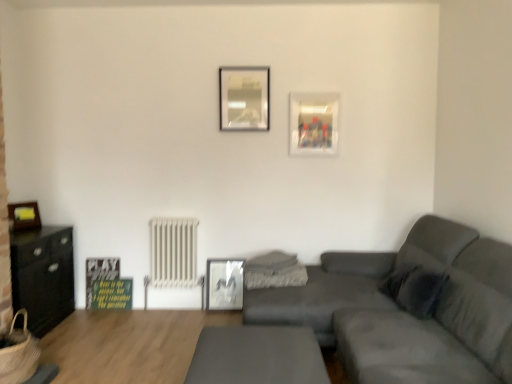
Question: Can you confirm if white metallic radiator at center-left is taller than matte black picture frame at left, which is the second picture frame from bottom to top?

Choices:
 (A) no
 (B) yes

Answer: (B)

Question: From the image's perspective, is white metallic radiator at center-left over matte black picture frame at left, which is the second picture frame from bottom to top?

Choices:
 (A) no
 (B) yes

Answer: (A)

Question: Is white metallic radiator at center-left next to matte black picture frame at left, placed as the third picture frame when sorted from top to bottom, and touching it?

Choices:
 (A) yes
 (B) no

Answer: (B)

Question: Is white metallic radiator at center-left outside of matte black picture frame at left, positioned as the 4th picture frame in right-to-left order?

Choices:
 (A) no
 (B) yes

Answer: (B)

Question: Is white metallic radiator at center-left far from matte black picture frame at left, which is the second picture frame from bottom to top?

Choices:
 (A) no
 (B) yes

Answer: (B)

Question: Looking at their shapes, would you say black matte cabinet at left is wider or thinner than smooth gray table at center?

Choices:
 (A) thin
 (B) wide

Answer: (A)

Question: From the image's perspective, relative to smooth gray table at center, is black matte cabinet at left above or below?

Choices:
 (A) below
 (B) above

Answer: (B)

Question: Is black matte cabinet at left bigger or smaller than smooth gray table at center?

Choices:
 (A) small
 (B) big

Answer: (B)

Question: Is point (33, 279) closer or farther from the camera than point (263, 336)?

Choices:
 (A) closer
 (B) farther

Answer: (B)

Question: From the image's perspective, is braided straw basket at lower left above or below smooth gray table at center?

Choices:
 (A) above
 (B) below

Answer: (A)

Question: From a real-world perspective, relative to smooth gray table at center, is braided straw basket at lower left vertically above or below?

Choices:
 (A) above
 (B) below

Answer: (A)

Question: Relative to smooth gray table at center, is braided straw basket at lower left in front or behind?

Choices:
 (A) front
 (B) behind

Answer: (B)

Question: Would you say braided straw basket at lower left is to the left or to the right of smooth gray table at center in the picture?

Choices:
 (A) left
 (B) right

Answer: (A)

Question: Is matte gray couch at center spatially inside white metallic radiator at center-left, or outside of it?

Choices:
 (A) inside
 (B) outside

Answer: (B)

Question: Considering the positions of matte gray couch at center and white metallic radiator at center-left in the image, is matte gray couch at center wider or thinner than white metallic radiator at center-left?

Choices:
 (A) wide
 (B) thin

Answer: (A)